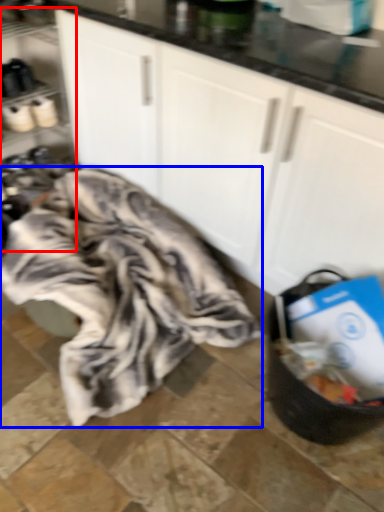
Question: Which object appears closest to the camera in this image, shelf (highlighted by a red box) or blanket (highlighted by a blue box)?

Choices:
 (A) shelf
 (B) blanket

Answer: (B)